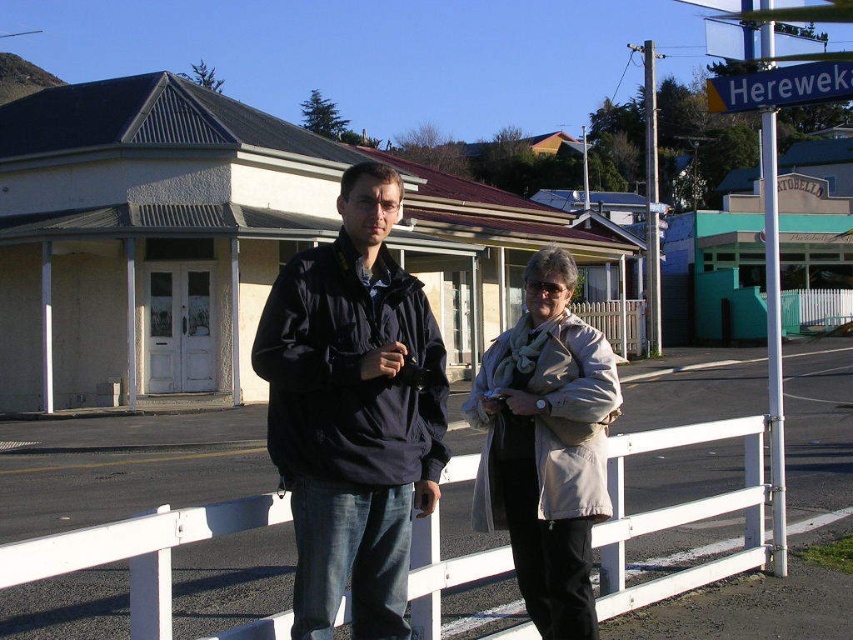
Which is above, white plastic rail at center or beige fabric coat at center?

beige fabric coat at center is higher up.

Identify the location of white plastic rail at center. This screenshot has height=640, width=853. (688, 513).

You are a GUI agent. You are given a task and a screenshot of the screen. Output one action in this format:
    pyautogui.click(x=<x>, y=<y>)
    Task: Click on the white plastic rail at center
    Image resolution: width=853 pixels, height=640 pixels.
    Given the screenshot: What is the action you would take?
    point(688,513)

Who is positioned more to the left, dark blue jacket at center or beige fabric coat at center?

Positioned to the left is dark blue jacket at center.

Is dark blue jacket at center further to the viewer compared to beige fabric coat at center?

No, dark blue jacket at center is closer to the viewer.

Between point (347, 424) and point (486, 508), which one is positioned behind?

Point (486, 508)

What are the coordinates of `dark blue jacket at center` in the screenshot? It's located at (352, 412).

Can you confirm if dark blue jacket at center is positioned to the right of white plastic rail at center?

Incorrect, dark blue jacket at center is not on the right side of white plastic rail at center.

Is dark blue jacket at center behind white plastic rail at center?

No, dark blue jacket at center is closer to the viewer.

Is point (321, 404) less distant than point (757, 536)?

Yes, point (321, 404) is closer to viewer.

Locate an element on the screen. dark blue jacket at center is located at coordinates (352, 412).